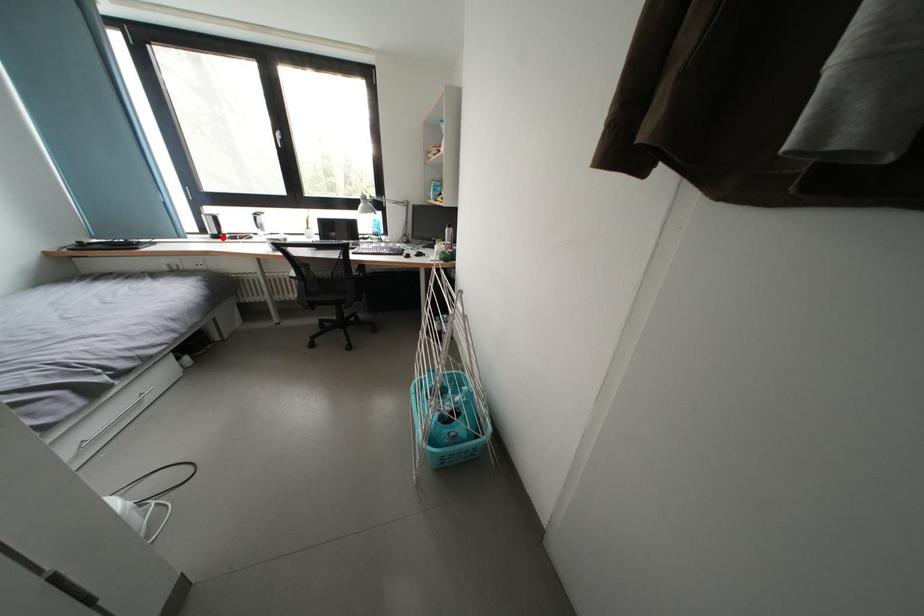
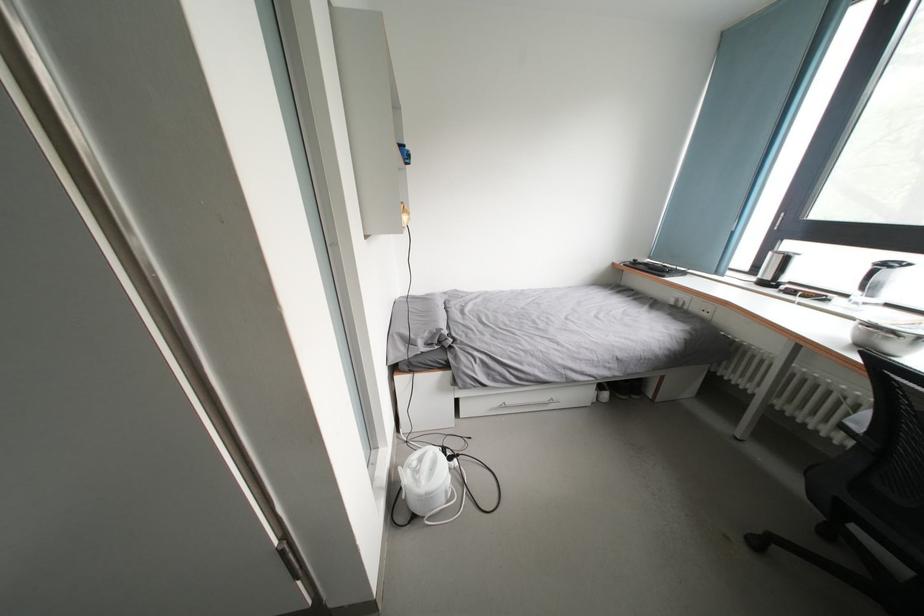
Find the pixel in the second image that matches the highlighted location in the first image.

(774, 283)